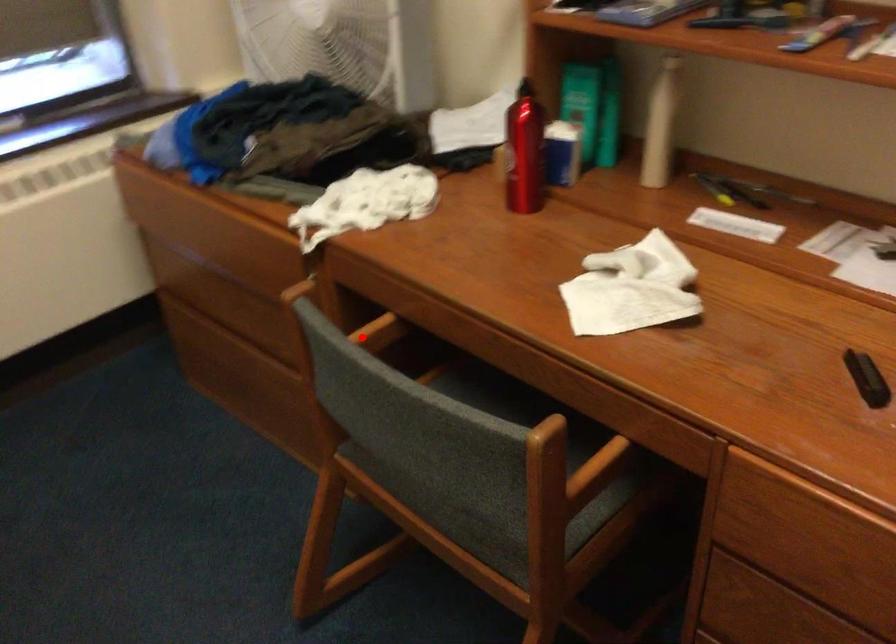
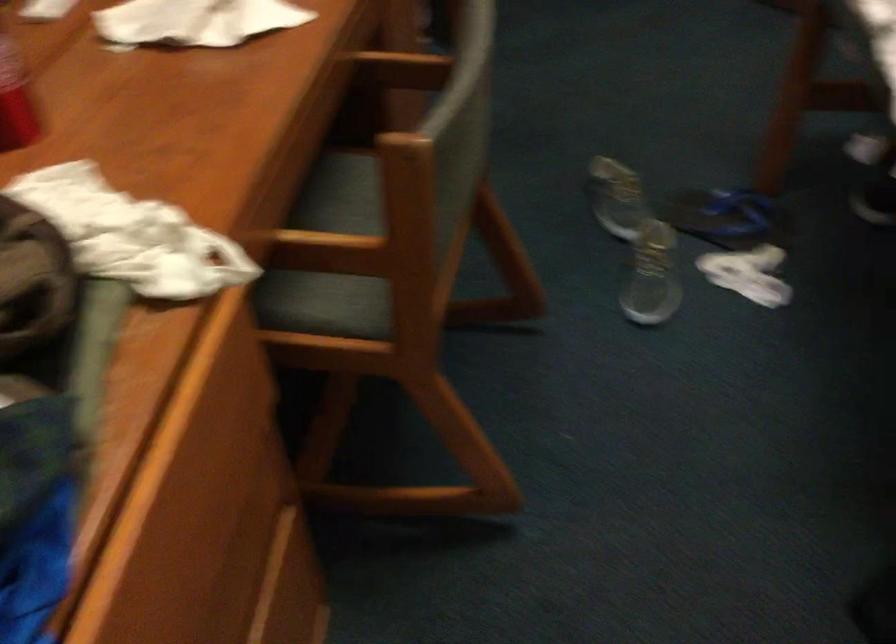
Locate, in the second image, the point that corresponds to the highlighted location in the first image.

(339, 250)